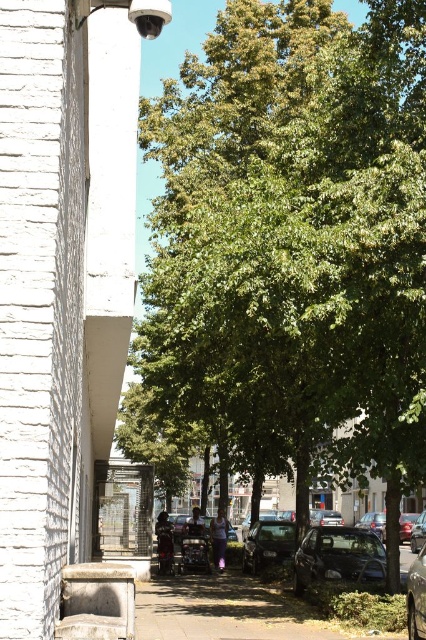
You are standing at the point marked by the coordinates point (x=291, y=241) in the image. What object are you facing?

You are facing the green leafy tree at center, as the point (x=291, y=241) represents its location.